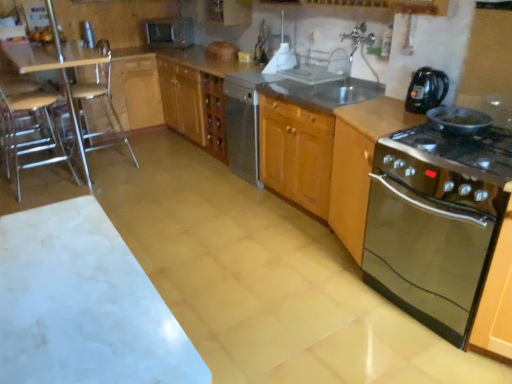
This screenshot has height=384, width=512. What do you see at coordinates (170, 32) in the screenshot?
I see `satin silver microwave at upper center` at bounding box center [170, 32].

You are a GUI agent. You are given a task and a screenshot of the screen. Output one action in this format:
    pyautogui.click(x=<x>, y=<y>)
    Task: Click on the metallic silver toaster at upper left
    
    Given the screenshot: What is the action you would take?
    [x=87, y=34]

How much space does clear plastic bar stool at left, positioned as the 2th bar stool in left-to-right order, occupy horizontally?

It is 21.43 inches.

From the picture: Measure the distance between point (x=435, y=99) and camera.

The depth of point (x=435, y=99) is 2.21 meters.

The height and width of the screenshot is (384, 512). Identify the location of black plastic kettle at upper right, arranged as the 1th kitchen appliance when viewed from the top. (426, 90).

This screenshot has height=384, width=512. In order to click on satin silver microwave at upper center in this screenshot , I will do `click(170, 32)`.

Considering the relative positions of wooden cabinet at center, which is the third cabinetry from front to back, and wooden seat at left, arranged as the second bar stool when viewed from the right, in the image provided, is wooden cabinet at center, which is the third cabinetry from front to back, behind wooden seat at left, arranged as the second bar stool when viewed from the right,?

No, the depth of wooden cabinet at center, which is the third cabinetry from front to back, is less than that of wooden seat at left, arranged as the second bar stool when viewed from the right.

Which object is positioned more to the left, wooden cabinet at center, which is the third cabinetry from front to back, or wooden seat at left, arranged as the second bar stool when viewed from the right?

wooden seat at left, arranged as the second bar stool when viewed from the right.

Is wooden cabinet at center, which is the third cabinetry from front to back, surrounding wooden seat at left, arranged as the second bar stool when viewed from the right?

No, wooden seat at left, arranged as the second bar stool when viewed from the right, is located outside of wooden cabinet at center, which is the third cabinetry from front to back.

Which is more to the left, stainless steel oven at right, positioned as the 2th cabinetry in front-to-back order, or white marble table at lower left, acting as the 1th table starting from the front?

white marble table at lower left, acting as the 1th table starting from the front, is more to the left.

Which of these two, stainless steel oven at right, positioned as the 2th cabinetry in front-to-back order, or white marble table at lower left, which ranks as the 2th table in back-to-front order, is bigger?

white marble table at lower left, which ranks as the 2th table in back-to-front order.

Is stainless steel oven at right, the second cabinetry when ordered from back to front, facing away from white marble table at lower left, the 2th table viewed from the left?

stainless steel oven at right, the second cabinetry when ordered from back to front, does not have its back to white marble table at lower left, the 2th table viewed from the left.

From the image's perspective, does stainless steel oven at right, positioned as the 2th cabinetry in front-to-back order, appear higher than white marble table at lower left, the second table when ordered from top to bottom?

Indeed, from the image's perspective, stainless steel oven at right, positioned as the 2th cabinetry in front-to-back order, is shown above white marble table at lower left, the second table when ordered from top to bottom.

Measure the distance from black stainless steel oven at right, marked as the 1th cabinetry in a front-to-back arrangement, to clear acrylic table at left, the second table in the right-to-left sequence.

3.28 meters.

From the image's perspective, relative to clear acrylic table at left, which appears as the 1th table when viewed from the top, is black stainless steel oven at right, placed as the third cabinetry when sorted from back to front, above or below?

Based on their image positions, black stainless steel oven at right, placed as the third cabinetry when sorted from back to front, is located beneath clear acrylic table at left, which appears as the 1th table when viewed from the top.

Is black stainless steel oven at right, marked as the 1th cabinetry in a front-to-back arrangement, aimed at clear acrylic table at left, the second table in the right-to-left sequence?

No, black stainless steel oven at right, marked as the 1th cabinetry in a front-to-back arrangement, does not turn towards clear acrylic table at left, the second table in the right-to-left sequence.

Consider the image. From a real-world perspective, relative to clear acrylic table at left, which ranks as the second table in front-to-back order, is black stainless steel oven at right, marked as the 1th cabinetry in a front-to-back arrangement, vertically above or below?

From a real-world perspective, black stainless steel oven at right, marked as the 1th cabinetry in a front-to-back arrangement, is physically below clear acrylic table at left, which ranks as the second table in front-to-back order.

Does black stainless steel oven at right, placed as the third cabinetry when sorted from back to front, appear on the left side of white marble table at lower left, acting as the 1th table starting from the front?

No, black stainless steel oven at right, placed as the third cabinetry when sorted from back to front, is not to the left of white marble table at lower left, acting as the 1th table starting from the front.

In the scene shown: Does black stainless steel oven at right, marked as the 1th cabinetry in a front-to-back arrangement, touch white marble table at lower left, which ranks as the 2th table in back-to-front order?

black stainless steel oven at right, marked as the 1th cabinetry in a front-to-back arrangement, and white marble table at lower left, which ranks as the 2th table in back-to-front order, are not in contact.

Looking at this image, from a real-world perspective, is black stainless steel oven at right, placed as the third cabinetry when sorted from back to front, physically above white marble table at lower left, which is counted as the first table, starting from the right?

Yes, from a real-world perspective, black stainless steel oven at right, placed as the third cabinetry when sorted from back to front, is over white marble table at lower left, which is counted as the first table, starting from the right

How different are the orientations of black stainless steel oven at right, placed as the third cabinetry when sorted from back to front, and white marble table at lower left, which is the 1th table in bottom-to-top order, in degrees?

90.7 degrees.

Is the depth of clear plastic bar stool at left, the first bar stool viewed from the right, less than that of satin silver microwave at upper center?

Yes, it is in front of satin silver microwave at upper center.

The image size is (512, 384). What are the coordinates of `the 1st bar stool positioned below the satin silver microwave at upper center (from the image's perspective)` in the screenshot? It's located at (101, 106).

Based on the photo, is clear plastic bar stool at left, the first bar stool viewed from the right, at the right side of satin silver microwave at upper center?

No, clear plastic bar stool at left, the first bar stool viewed from the right, is not to the right of satin silver microwave at upper center.

How different are the orientations of clear plastic bar stool at left, positioned as the 2th bar stool in left-to-right order, and satin silver microwave at upper center in degrees?

clear plastic bar stool at left, positioned as the 2th bar stool in left-to-right order, and satin silver microwave at upper center are facing 47 degrees away from each other.

Based on the photo, is black glass stove at right, the 2th kitchen appliance when ordered from top to bottom, at the left side of stainless steel oven at right, positioned as the 2th cabinetry in front-to-back order?

No.

From the image's perspective, is black glass stove at right, the 2th kitchen appliance when ordered from top to bottom, positioned above or below stainless steel oven at right, the second cabinetry when ordered from back to front?

Clearly, from the image's perspective, black glass stove at right, the 2th kitchen appliance when ordered from top to bottom, is below stainless steel oven at right, the second cabinetry when ordered from back to front.

Can you confirm if black glass stove at right, acting as the 1th kitchen appliance starting from the bottom, is bigger than stainless steel oven at right, positioned as the 2th cabinetry in front-to-back order?

Indeed, black glass stove at right, acting as the 1th kitchen appliance starting from the bottom, has a larger size compared to stainless steel oven at right, positioned as the 2th cabinetry in front-to-back order.

In the scene shown: Is wooden cabinet at center, which is the third cabinetry from front to back, not within stainless steel oven at right, positioned as the 2th cabinetry in front-to-back order?

Yes.

Does wooden cabinet at center, which is the third cabinetry from front to back, have a lesser width compared to stainless steel oven at right, positioned as the 2th cabinetry in front-to-back order?

No.

Is wooden cabinet at center, which is the third cabinetry from front to back, oriented away from stainless steel oven at right, positioned as the 2th cabinetry in front-to-back order?

No, wooden cabinet at center, which is the third cabinetry from front to back, is not facing away from stainless steel oven at right, positioned as the 2th cabinetry in front-to-back order.

Is wooden cabinet at center, which is the third cabinetry from front to back, in front of stainless steel oven at right, the second cabinetry when ordered from back to front?

No, wooden cabinet at center, which is the third cabinetry from front to back, is further to the viewer.

This screenshot has height=384, width=512. What are the coordinates of `cabinetry that is the 1st one when counting forward from the wooden seat at left, which is the first bar stool from left to right` in the screenshot? It's located at tap(316, 165).

I want to click on table directly beneath the stainless steel oven at right, positioned as the 2th cabinetry in front-to-back order (from a real-world perspective), so click(x=83, y=304).

Which object lies further to the anchor point white marble table at lower left, which is the 1th table in bottom-to-top order, black stainless steel oven at right, marked as the 1th cabinetry in a front-to-back arrangement, or satin silver dishwasher at center?

satin silver dishwasher at center lies further to white marble table at lower left, which is the 1th table in bottom-to-top order, than the other object.

Looking at the image, which one is located further to satin silver microwave at upper center, metallic silver toaster at upper left or black plastic kettle at upper right, arranged as the 1th kitchen appliance when viewed from the top?

black plastic kettle at upper right, arranged as the 1th kitchen appliance when viewed from the top.

Estimate the real-world distances between objects in this image. Which object is further from black plastic kettle at upper right, the second kitchen appliance in the bottom-to-top sequence, satin silver microwave at upper center or wooden cabinet at center, which is the third cabinetry from front to back?

The object further to black plastic kettle at upper right, the second kitchen appliance in the bottom-to-top sequence, is satin silver microwave at upper center.

Estimate the real-world distances between objects in this image. Which object is further from clear plastic bar stool at left, the first bar stool viewed from the right, white marble table at lower left, which is the 1th table in bottom-to-top order, or wooden cabinet at center, which is the third cabinetry from front to back?

The object further to clear plastic bar stool at left, the first bar stool viewed from the right, is white marble table at lower left, which is the 1th table in bottom-to-top order.

Based on the photo, when comparing their distances from clear plastic bar stool at left, the first bar stool viewed from the right, does satin silver dishwasher at center or satin silver microwave at upper center seem closer?

satin silver microwave at upper center.

From the image, which object appears to be nearer to black glass stove at right, the 2th kitchen appliance when ordered from top to bottom, white marble table at lower left, which is the 1th table in bottom-to-top order, or wooden seat at left, arranged as the second bar stool when viewed from the right?

white marble table at lower left, which is the 1th table in bottom-to-top order, lies closer to black glass stove at right, the 2th kitchen appliance when ordered from top to bottom, than the other object.

When comparing their distances from wooden cabinet at center, which is the third cabinetry from front to back, does stainless steel oven at right, the second cabinetry when ordered from back to front, or satin silver microwave at upper center seem further?

Among the two, satin silver microwave at upper center is located further to wooden cabinet at center, which is the third cabinetry from front to back.

From the image, which object appears to be nearer to metallic silver toaster at upper left, satin silver dishwasher at center or black stainless steel oven at right, placed as the third cabinetry when sorted from back to front?

satin silver dishwasher at center is positioned closer to the anchor metallic silver toaster at upper left.

You are a GUI agent. You are given a task and a screenshot of the screen. Output one action in this format:
    pyautogui.click(x=<x>, y=<y>)
    Task: Click on the appliance between clear acrylic table at left, the first table from the back, and black glass stove at right, the 2th kitchen appliance when ordered from top to bottom, from left to right
    
    Given the screenshot: What is the action you would take?
    pyautogui.click(x=87, y=34)

The height and width of the screenshot is (384, 512). Find the location of `table between wooden seat at left, which is the first bar stool from left to right, and black stainless steel oven at right, placed as the third cabinetry when sorted from back to front, in the horizontal direction`. table between wooden seat at left, which is the first bar stool from left to right, and black stainless steel oven at right, placed as the third cabinetry when sorted from back to front, in the horizontal direction is located at coordinates (83, 304).

Find the location of a particular element. The width and height of the screenshot is (512, 384). kitchen appliance between black glass stove at right, acting as the 1th kitchen appliance starting from the bottom, and wooden cabinet at center, acting as the 1th cabinetry starting from the back, in the front-back direction is located at coordinates (426, 90).

This screenshot has height=384, width=512. Identify the location of table between clear acrylic table at left, which ranks as the second table in front-to-back order, and stainless steel oven at right, the second cabinetry when ordered from back to front, in the horizontal direction. (83, 304).